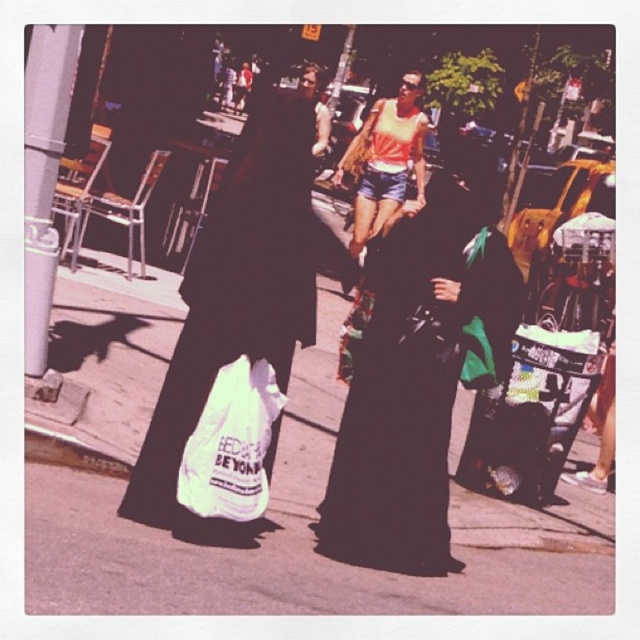
Looking at this image, can you confirm if black matte abaya at center is positioned above white matte plastic bag at center?

Yes.

Between black matte abaya at center and white matte plastic bag at center, which one is positioned higher?

black matte abaya at center

Between point (481, 168) and point (248, 173), which one is positioned behind?

The point (481, 168) is behind.

This screenshot has width=640, height=640. I want to click on black matte abaya at center, so click(x=419, y=372).

Is point (176, 362) farther from camera compared to point (236, 417)?

Yes.

Looking at this image, can you confirm if white matte plastic bag at center is positioned to the right of white plastic bag at lower center?

No, white matte plastic bag at center is not to the right of white plastic bag at lower center.

Identify the location of white matte plastic bag at center. (236, 300).

In the scene shown: Who is more distant from viewer, (394, 592) or (252, 346)?

The point (394, 592) is behind.

Find the location of a particular element. The height and width of the screenshot is (640, 640). white paper bag at center is located at coordinates (310, 540).